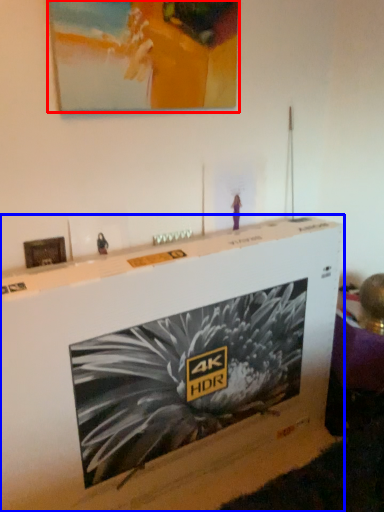
Question: Among these objects, which one is nearest to the camera, picture frame (highlighted by a red box) or furniture (highlighted by a blue box)?

Choices:
 (A) picture frame
 (B) furniture

Answer: (B)